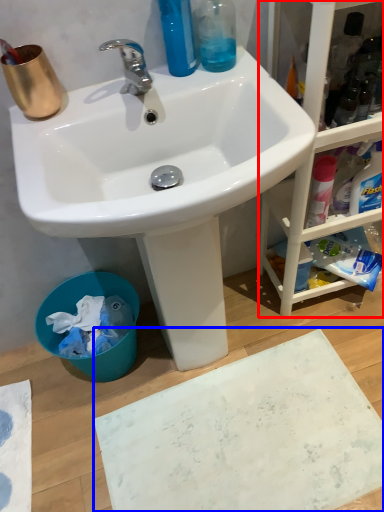
Question: Which object is further to the camera taking this photo, cabinetry (highlighted by a red box) or bath mat (highlighted by a blue box)?

Choices:
 (A) cabinetry
 (B) bath mat

Answer: (B)